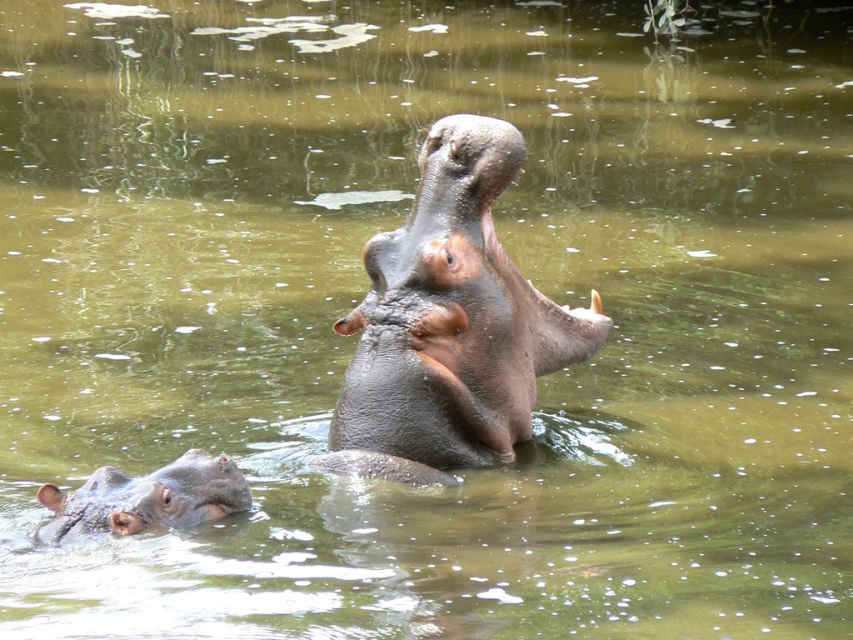
Describe the element at coordinates (450, 323) in the screenshot. I see `dark gray textured hippo at center` at that location.

Who is more distant from viewer, (350, 445) or (149, 490)?

Positioned behind is point (350, 445).

Where is `dark gray textured hippo at center`? This screenshot has height=640, width=853. dark gray textured hippo at center is located at coordinates (450, 323).